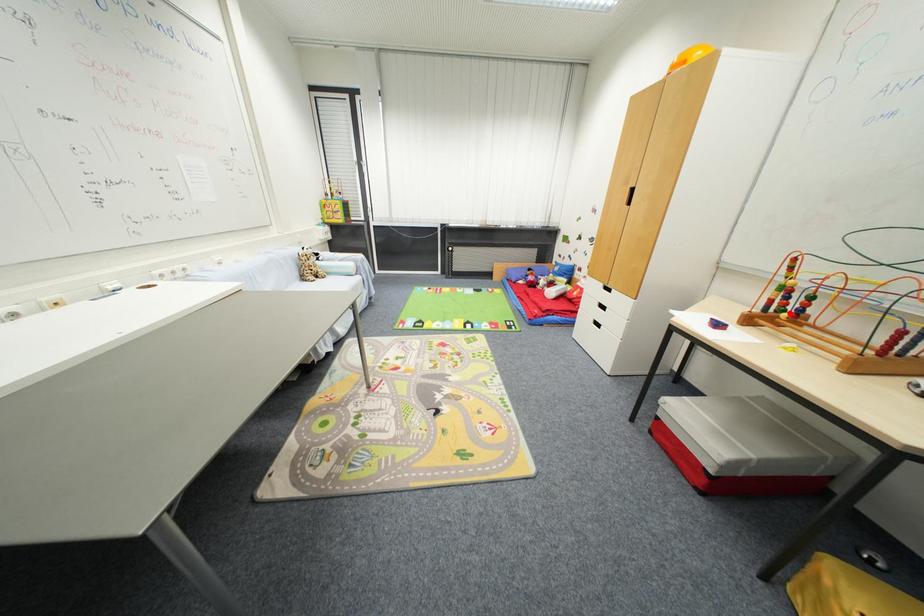
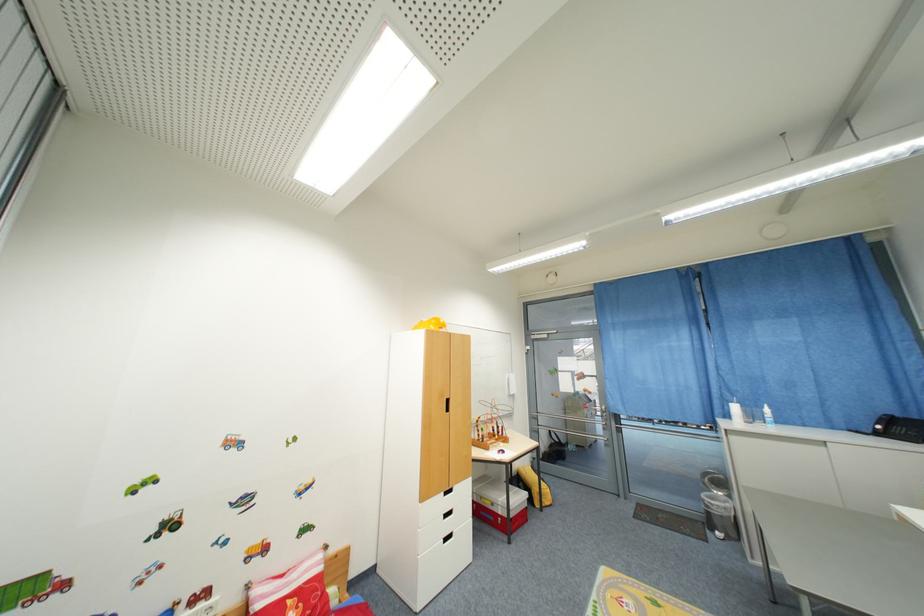
In the second image, find the point that corresponds to the highlighted location in the first image.

(500, 438)